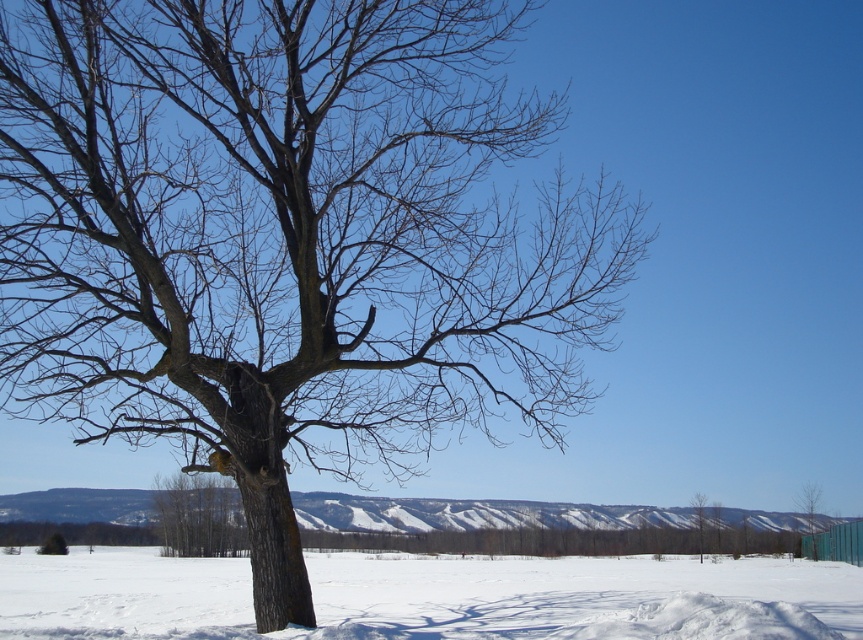
Question: Can you confirm if white powdery snow at center is bigger than green matte tree at lower right?

Choices:
 (A) yes
 (B) no

Answer: (A)

Question: Which object is positioned farthest from the green matte tree at right?

Choices:
 (A) white powdery snow at center
 (B) green matte tree at lower right

Answer: (A)

Question: Which object is farther from the camera taking this photo?

Choices:
 (A) green matte tree at lower right
 (B) green matte tree at right
 (C) white powdery snow at center

Answer: (B)

Question: Does green matte tree at right appear under green matte tree at lower right?

Choices:
 (A) yes
 (B) no

Answer: (A)

Question: Which point appears closest to the camera in this image?

Choices:
 (A) (704, 497)
 (B) (219, 596)

Answer: (B)

Question: Can you confirm if white powdery snow at center is smaller than green matte tree at lower right?

Choices:
 (A) yes
 (B) no

Answer: (B)